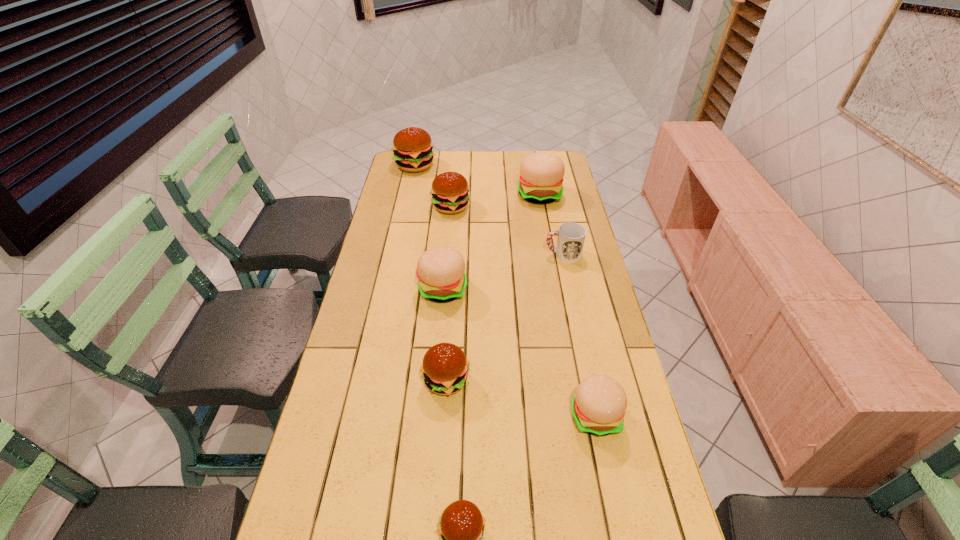
Where is `vacant space situated 0.290m on the front of the biggest brown hamburger`? The image size is (960, 540). vacant space situated 0.290m on the front of the biggest brown hamburger is located at coordinates click(404, 214).

This screenshot has width=960, height=540. Find the location of `free space located 0.280m on the left of the farthest beige hamburger`. free space located 0.280m on the left of the farthest beige hamburger is located at coordinates (451, 194).

Image resolution: width=960 pixels, height=540 pixels. What are the coordinates of `vacant area situated on the left of the second biggest brown hamburger` in the screenshot? It's located at (409, 207).

The width and height of the screenshot is (960, 540). In order to click on vacant area located 0.140m on the left of the second nearest beige hamburger in this screenshot , I will do [375, 289].

Where is `free point located 0.120m on the front of the second smallest brown hamburger`? The image size is (960, 540). free point located 0.120m on the front of the second smallest brown hamburger is located at coordinates (442, 446).

This screenshot has width=960, height=540. What are the coordinates of `vacant space located on the back of the nearest beige hamburger` in the screenshot? It's located at (574, 315).

At what (x,y) coordinates should I click in order to perform the action: click on free location located on the handle side of the fifth nearest object. Please return your answer as a coordinate pair (x, y). This screenshot has height=540, width=960. Looking at the image, I should click on (522, 254).

Where is `vacant area located 0.240m on the handle side of the fifth nearest object`? The width and height of the screenshot is (960, 540). vacant area located 0.240m on the handle side of the fifth nearest object is located at coordinates (477, 254).

Image resolution: width=960 pixels, height=540 pixels. Identify the location of vacant space situated on the handle side of the fifth nearest object. (461, 254).

I want to click on object that is at the far edge, so click(x=412, y=147).